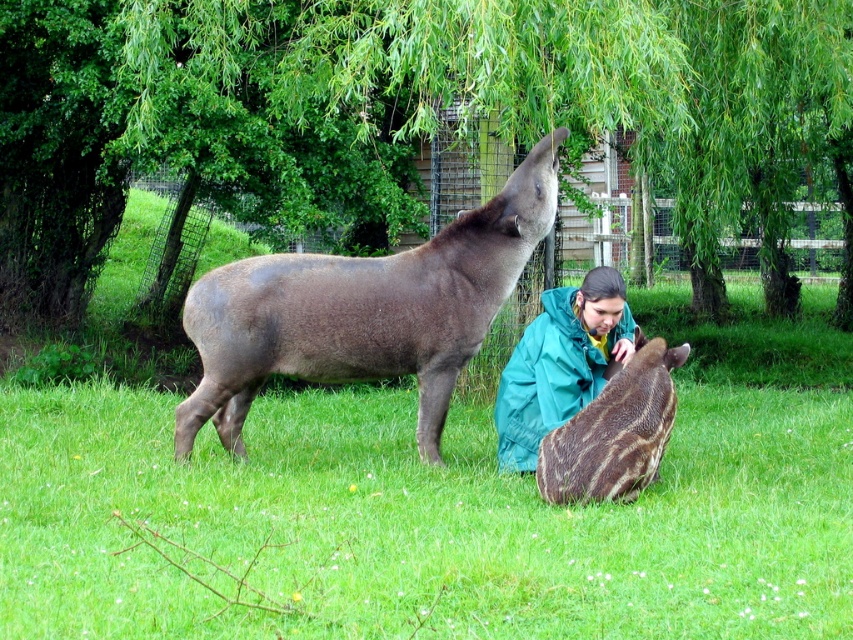
You are a photographer standing in the grassy area. You want to capture a photo where both the green grass at center and the teal fabric jacket at center are visible. Which object should you frame first to ensure both are in the shot?

The green grass at center is wider than the teal fabric jacket at center, so you should frame the green grass at center first to ensure both objects are fully visible in the photo.

You are standing in the grassy area looking at the scene. Which object is nearer to you, the green grass at center or the teal fabric jacket at center?

The green grass at center is closer to the viewer than the teal fabric jacket at center.